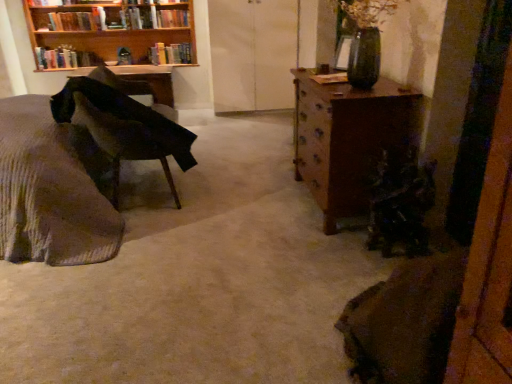
Question: Does wooden desk at left touch hardcover books at upper left, arranged as the first book when viewed from the left?

Choices:
 (A) yes
 (B) no

Answer: (B)

Question: Are wooden desk at left and hardcover books at upper left, acting as the 3th book starting from the right, located far from each other?

Choices:
 (A) yes
 (B) no

Answer: (B)

Question: Is wooden desk at left outside hardcover books at upper left, arranged as the first book when viewed from the left?

Choices:
 (A) yes
 (B) no

Answer: (A)

Question: Is wooden desk at left closer to the viewer compared to hardcover books at upper left, arranged as the first book when viewed from the left?

Choices:
 (A) yes
 (B) no

Answer: (A)

Question: Considering the relative sizes of wooden desk at left and hardcover books at upper left, arranged as the first book when viewed from the left, in the image provided, is wooden desk at left taller than hardcover books at upper left, arranged as the first book when viewed from the left,?

Choices:
 (A) yes
 (B) no

Answer: (A)

Question: Does wooden desk at left have a larger size compared to hardcover books at upper left, acting as the 3th book starting from the right?

Choices:
 (A) no
 (B) yes

Answer: (B)

Question: Is hardcover book at upper center, which is counted as the 1th book, starting from the right, positioned behind woolen fabric bed at left?

Choices:
 (A) yes
 (B) no

Answer: (A)

Question: Can you confirm if hardcover book at upper center, which is counted as the 1th book, starting from the right, is shorter than woolen fabric bed at left?

Choices:
 (A) yes
 (B) no

Answer: (A)

Question: From a real-world perspective, is hardcover book at upper center, which is the 3th book in left-to-right order, positioned over woolen fabric bed at left based on gravity?

Choices:
 (A) yes
 (B) no

Answer: (A)

Question: Is hardcover book at upper center, which is the 3th book in left-to-right order, not inside woolen fabric bed at left?

Choices:
 (A) no
 (B) yes

Answer: (B)

Question: Does hardcover book at upper center, which is counted as the 1th book, starting from the right, contain woolen fabric bed at left?

Choices:
 (A) yes
 (B) no

Answer: (B)

Question: Is hardcover book at upper center, which is counted as the 1th book, starting from the right, directly adjacent to woolen fabric bed at left?

Choices:
 (A) no
 (B) yes

Answer: (A)

Question: Is hardcover book at upper left, which appears as the 2th book when viewed from the left, shorter than woolen fabric bed at left?

Choices:
 (A) yes
 (B) no

Answer: (A)